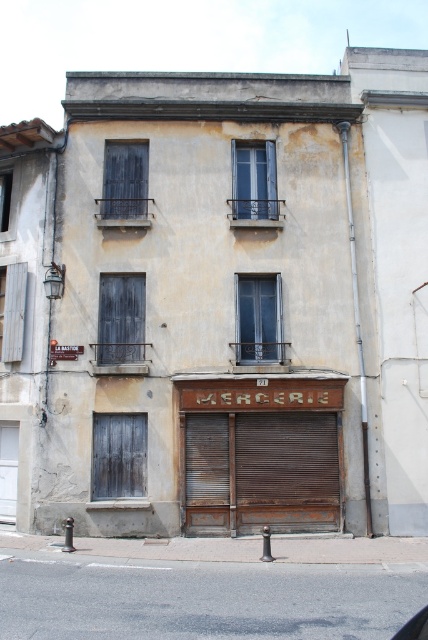
Question: Is brown wooden garage door at center thinner than brown wooden shutter at left?

Choices:
 (A) yes
 (B) no

Answer: (B)

Question: Which point is closer to the camera?

Choices:
 (A) dark wood shutter at left
 (B) gray wood door at lower left
 (C) dark wood shutter at upper left
 (D) matte glass window at center

Answer: (B)

Question: Is dark wood shutter at upper left positioned in front of metallic gray car at lower right?

Choices:
 (A) yes
 (B) no

Answer: (B)

Question: Which point appears farthest from the camera in this image?

Choices:
 (A) (11, 316)
 (B) (285, 442)

Answer: (A)

Question: Is brown wooden garage door at center wider than gray wood door at lower left?

Choices:
 (A) yes
 (B) no

Answer: (A)

Question: Among these objects, which one is nearest to the camera?

Choices:
 (A) brown wooden garage door at center
 (B) metallic gray car at lower right

Answer: (B)